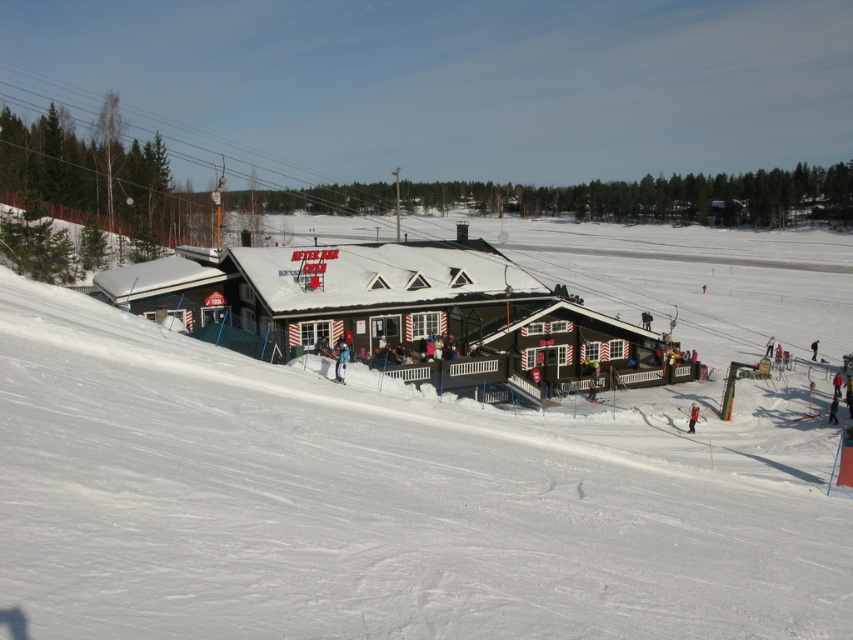
Who is taller, white powdery snow at center or red ski suit at center?

white powdery snow at center is taller.

Does white powdery snow at center have a lesser height compared to red ski suit at center?

No, white powdery snow at center is not shorter than red ski suit at center.

Does point (328, 413) lie in front of point (689, 413)?

Yes.

Identify the location of white powdery snow at center. (432, 470).

Does blue denim jacket at center have a greater width compared to red ski suit at center?

Correct, the width of blue denim jacket at center exceeds that of red ski suit at center.

Can you confirm if blue denim jacket at center is positioned below red ski suit at center?

No.

Who is more forward, (340, 368) or (691, 404)?

Point (340, 368) is more forward.

Find the location of a particular element. This screenshot has height=640, width=853. blue denim jacket at center is located at coordinates (341, 362).

Based on the photo, does white powdery snow at center have a smaller size compared to blue denim jacket at center?

No, white powdery snow at center is not smaller than blue denim jacket at center.

Looking at this image, can you confirm if white powdery snow at center is positioned to the right of blue denim jacket at center?

Indeed, white powdery snow at center is positioned on the right side of blue denim jacket at center.

Does point (840, 625) come in front of point (347, 356)?

Yes, it is in front of point (347, 356).

Image resolution: width=853 pixels, height=640 pixels. I want to click on white powdery snow at center, so click(432, 470).